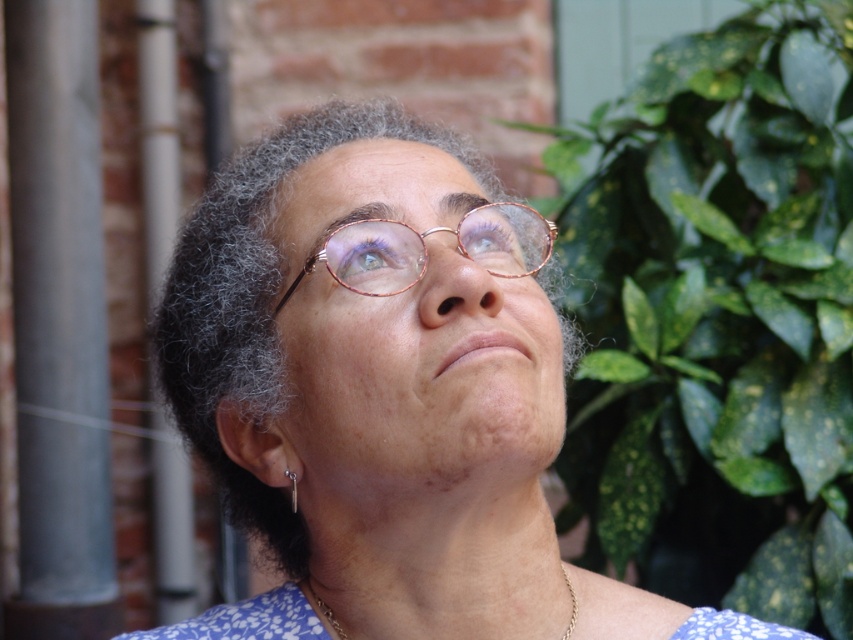
Is point (276, 515) more distant than point (338, 632)?

Yes, point (276, 515) is behind point (338, 632).

Who is positioned more to the left, gray curly hair at center or gold chain necklace at center?

gray curly hair at center is more to the left.

The width and height of the screenshot is (853, 640). Find the location of `gray curly hair at center`. gray curly hair at center is located at coordinates coord(258,301).

I want to click on gray curly hair at center, so (x=258, y=301).

Is green leafy plant at right bigger than gold chain necklace at center?

Indeed, green leafy plant at right has a larger size compared to gold chain necklace at center.

Can you confirm if green leafy plant at right is positioned to the left of gold chain necklace at center?

No, green leafy plant at right is not to the left of gold chain necklace at center.

Does point (780, 289) come closer to viewer compared to point (576, 602)?

No, (780, 289) is further to viewer.

Locate an element on the screen. Image resolution: width=853 pixels, height=640 pixels. green leafy plant at right is located at coordinates (717, 317).

Does point (374, 240) lie behind point (502, 266)?

No.

Where is `purple matte eye at upper center`? This screenshot has height=640, width=853. purple matte eye at upper center is located at coordinates (372, 259).